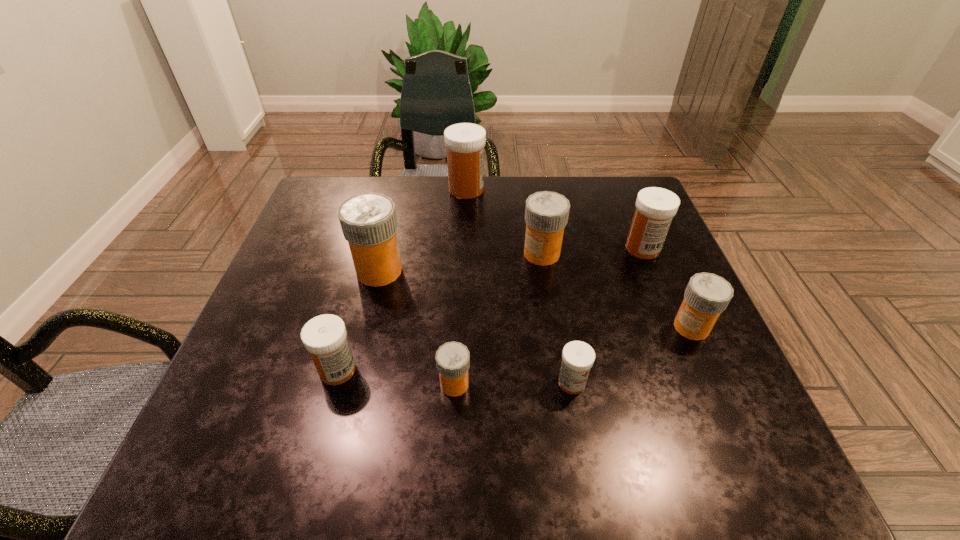
At what (x,y) coordinates should I click in order to perform the action: click on the farthest medicine. Please return your answer as a coordinate pair (x, y). This screenshot has width=960, height=540. Looking at the image, I should click on coord(465,142).

The height and width of the screenshot is (540, 960). In order to click on the farthest white medicine in this screenshot , I will do `click(465, 142)`.

Where is `the leftmost orange medicine`? The image size is (960, 540). the leftmost orange medicine is located at coordinates (368, 221).

Locate an element on the screen. This screenshot has height=540, width=960. the rightmost white medicine is located at coordinates (655, 207).

Where is `the third nearest white medicine`? This screenshot has width=960, height=540. the third nearest white medicine is located at coordinates (655, 207).

I want to click on the third orange medicine from left to right, so click(x=546, y=214).

Where is `the rightmost orange medicine`? Image resolution: width=960 pixels, height=540 pixels. the rightmost orange medicine is located at coordinates (707, 295).

This screenshot has width=960, height=540. I want to click on the fourth nearest object, so (707, 295).

This screenshot has height=540, width=960. Identify the location of the second smallest white medicine. (325, 337).

Identify the location of the third orange medicine from right to left. (452, 359).